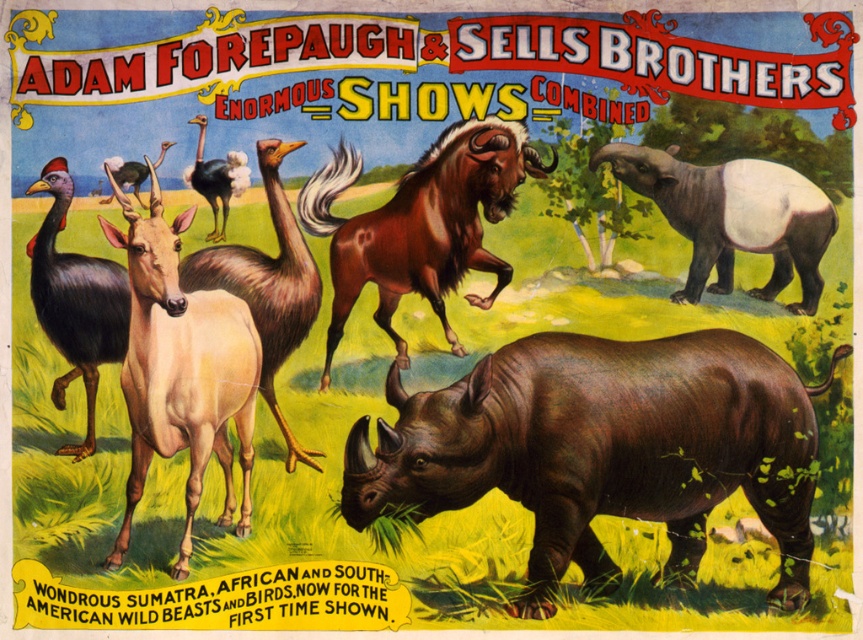
Looking at the vintage poster, there is a brown shaggy horse at center and a black feathered bird at left. Which animal takes up more space in the image?

The brown shaggy horse at center is bigger than the black feathered bird at left, so it takes up more space in the image.

Based on the vintage poster scene, which animal is larger between the light brown glossy antelope at center and the black feathered bird at left?

The light brown glossy antelope at center is bigger than the black feathered bird at left.